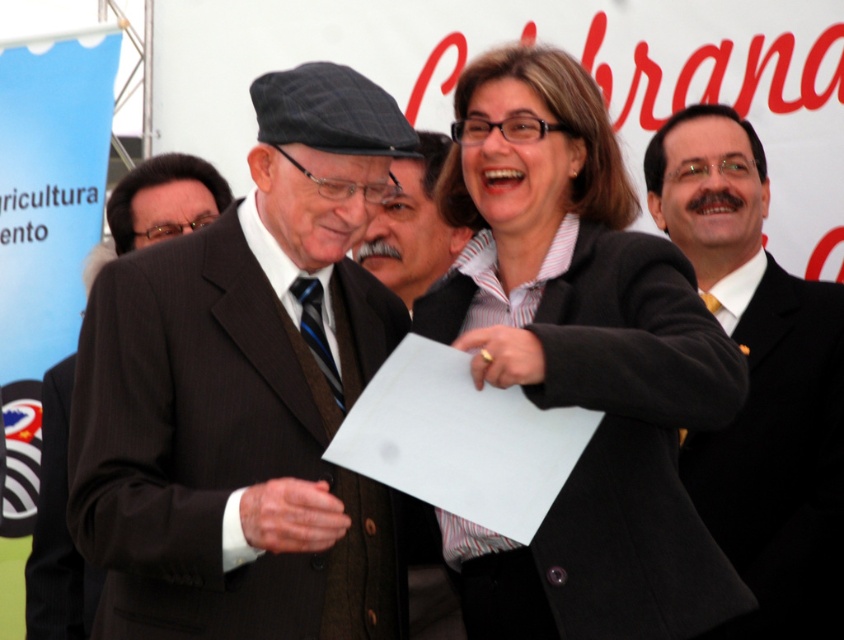
Which is in front, point (206, 540) or point (39, 611)?

Point (206, 540)

Is point (239, 582) behind point (60, 417)?

No, (239, 582) is closer to viewer.

Identify the location of dark brown suit at center. (246, 394).

Which of these two, dark brown suit at center or matte black blazer at center, stands taller?

dark brown suit at center

Between point (269, 365) and point (444, 516), which one is positioned in front?

Positioned in front is point (269, 365).

The height and width of the screenshot is (640, 844). Describe the element at coordinates (246, 394) in the screenshot. I see `dark brown suit at center` at that location.

Locate an element on the screen. The height and width of the screenshot is (640, 844). dark brown suit at center is located at coordinates (246, 394).

Is dark brown suit at center positioned in front of matte black suit at center?

Yes, it is.

Can you confirm if dark brown suit at center is bigger than matte black suit at center?

Correct, dark brown suit at center is larger in size than matte black suit at center.

The width and height of the screenshot is (844, 640). I want to click on dark brown suit at center, so click(246, 394).

Where is `dark brown suit at center`? The width and height of the screenshot is (844, 640). dark brown suit at center is located at coordinates (246, 394).